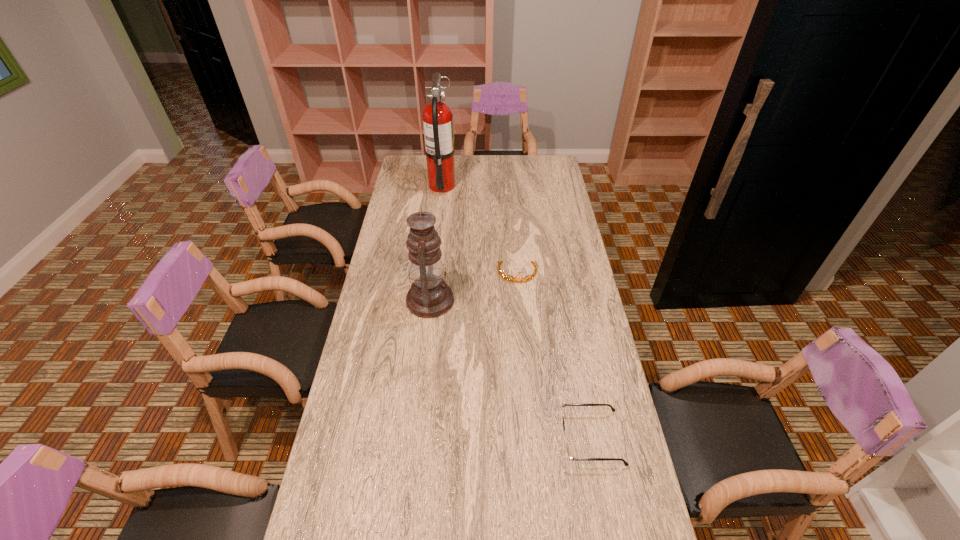
Image resolution: width=960 pixels, height=540 pixels. I want to click on empty space between the oil lamp and the third tallest object, so click(474, 287).

Locate which object ranks second in proximity to the fire extinguisher. Please provide its 2D coordinates. Your answer should be formatted as a tuple, i.e. [(x, y)], where the tuple contains the x and y coordinates of a point satisfying the conditions above.

[(429, 296)]

I want to click on object that ranks as the closest to the second object from right to left, so (x=429, y=296).

This screenshot has width=960, height=540. Identify the location of vacant space that satisfies the following two spatial constraints: 1. on the back side of the third shortest object; 2. on the nozzle side of the tallest object. tap(443, 186).

This screenshot has height=540, width=960. I want to click on vacant area in the image that satisfies the following two spatial constraints: 1. on the nozzle side of the tallest object; 2. on the back side of the third shortest object, so click(429, 300).

Image resolution: width=960 pixels, height=540 pixels. What are the coordinates of `free region that satisfies the following two spatial constraints: 1. on the nozzle side of the oil lamp; 2. on the left side of the tallest object` in the screenshot? It's located at (429, 300).